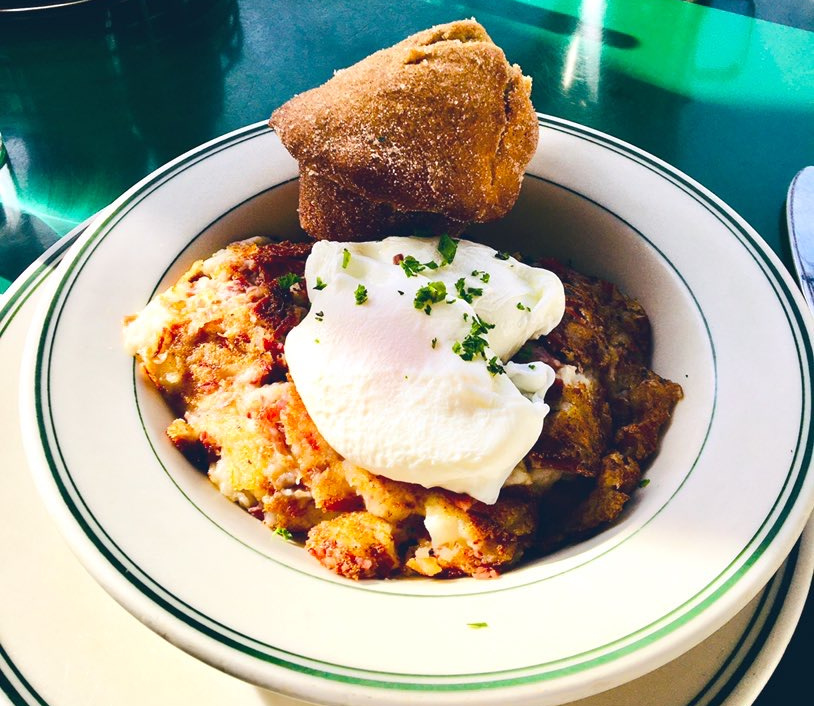
Where is `dish`? This screenshot has height=706, width=814. dish is located at coordinates (241, 594), (95, 647).